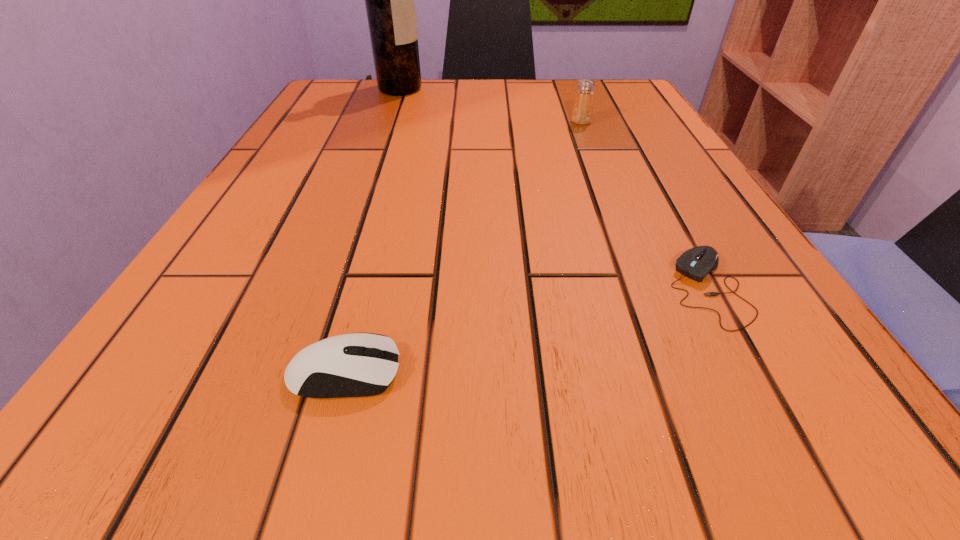
The height and width of the screenshot is (540, 960). What are the coordinates of `vacant area that lies between the liquor and the nearer computer mouse` in the screenshot? It's located at (372, 231).

At what (x,y) coordinates should I click in order to perform the action: click on free space between the rightmost object and the tallest object. Please return your answer as a coordinate pair (x, y). The width and height of the screenshot is (960, 540). Looking at the image, I should click on (554, 188).

At what (x,y) coordinates should I click in order to perform the action: click on free spot between the shortest object and the third object from left to right. Please return your answer as a coordinate pair (x, y). The height and width of the screenshot is (540, 960). Looking at the image, I should click on (644, 205).

Find the location of a particular element. The image size is (960, 540). free space that is in between the liquor and the third tallest object is located at coordinates (372, 231).

Where is `free area in between the saltshaker and the left computer mouse`? The height and width of the screenshot is (540, 960). free area in between the saltshaker and the left computer mouse is located at coordinates (463, 247).

I want to click on vacant point located between the nearest object and the liquor, so click(x=372, y=231).

This screenshot has height=540, width=960. In order to click on free point between the liquor and the saltshaker in this screenshot , I will do `click(491, 105)`.

Image resolution: width=960 pixels, height=540 pixels. In order to click on object that stands as the third closest to the nearer computer mouse in this screenshot , I will do (x=389, y=0).

At what (x,y) coordinates should I click in order to perform the action: click on object that stands as the closest to the right computer mouse. Please return your answer as a coordinate pair (x, y). Looking at the image, I should click on (350, 365).

Locate an element on the screen. The width and height of the screenshot is (960, 540). vacant area in the image that satisfies the following two spatial constraints: 1. on the back side of the saltshaker; 2. on the front-facing side of the liquor is located at coordinates coord(568,89).